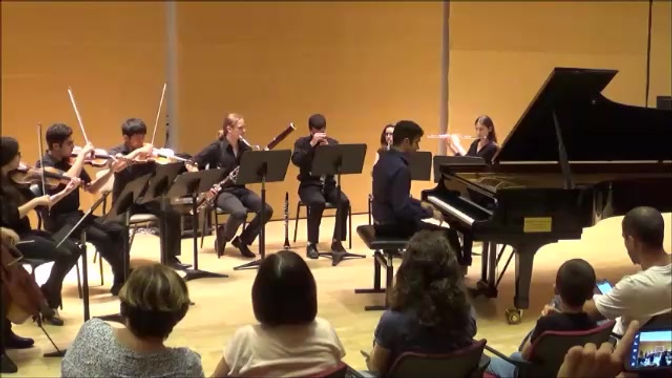
I want to click on chair, so click(423, 359).